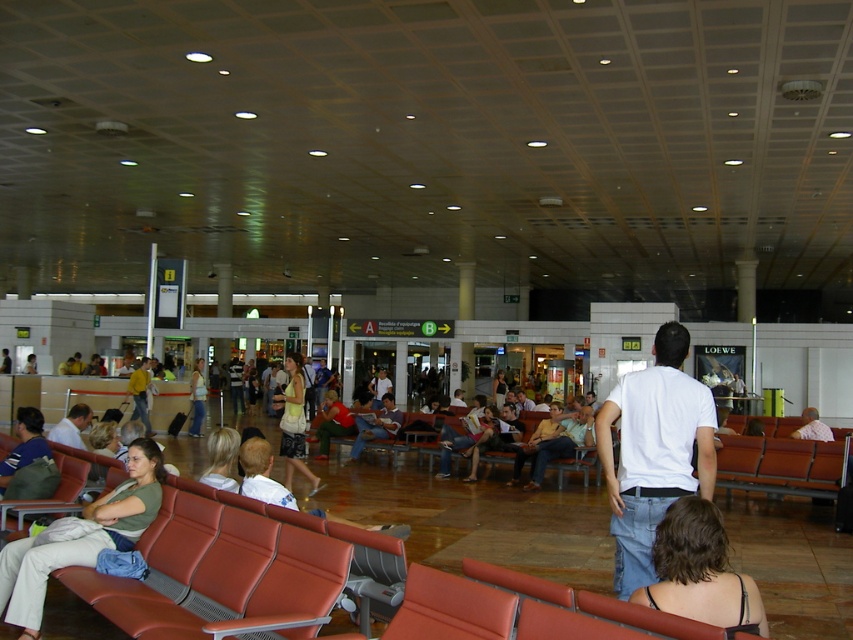
Is point (138, 525) in front of point (201, 404)?

Yes, point (138, 525) is closer to viewer.

Consider the image. Between light beige pants at lower left and light brown leather jacket at center, which one is positioned higher?

light beige pants at lower left is higher up.

Image resolution: width=853 pixels, height=640 pixels. What are the coordinates of `light beige pants at lower left` in the screenshot? It's located at 80,538.

At what (x,y) coordinates should I click in order to perform the action: click on light beige pants at lower left. Please return your answer as a coordinate pair (x, y). The width and height of the screenshot is (853, 640). Looking at the image, I should click on (80, 538).

At what (x,y) coordinates should I click in order to perform the action: click on matte yellow dress at center. Please return your answer as a coordinate pair (x, y). This screenshot has height=640, width=853. Looking at the image, I should click on (294, 422).

Does matte yellow dress at center appear under yellow cotton shirt at center?

Yes.

What do you see at coordinates (294, 422) in the screenshot? I see `matte yellow dress at center` at bounding box center [294, 422].

Find the location of a particular element. This screenshot has width=853, height=640. matte yellow dress at center is located at coordinates (294, 422).

Can you confirm if white cotton shirt at center is positioned below yellow cotton shirt at center?

Incorrect, white cotton shirt at center is not positioned below yellow cotton shirt at center.

Who is more distant from viewer, [675,394] or [138,368]?

The point [138,368] is behind.

Describe the element at coordinates (653, 452) in the screenshot. This screenshot has width=853, height=640. I see `white cotton shirt at center` at that location.

Locate an element on the screen. white cotton shirt at center is located at coordinates (653, 452).